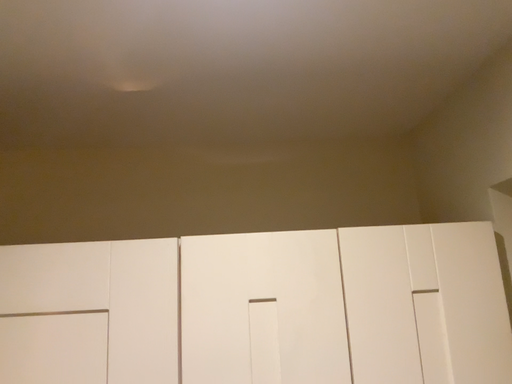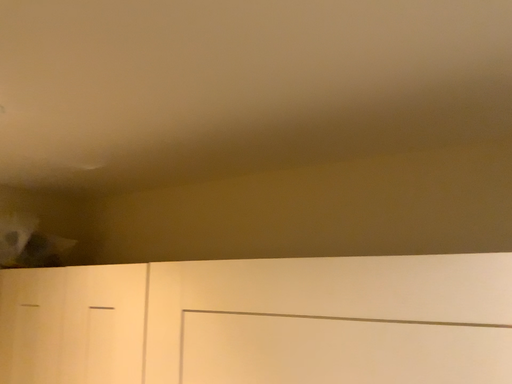
Question: Which way did the camera rotate in the video?

Choices:
 (A) rotated left
 (B) rotated right

Answer: (A)